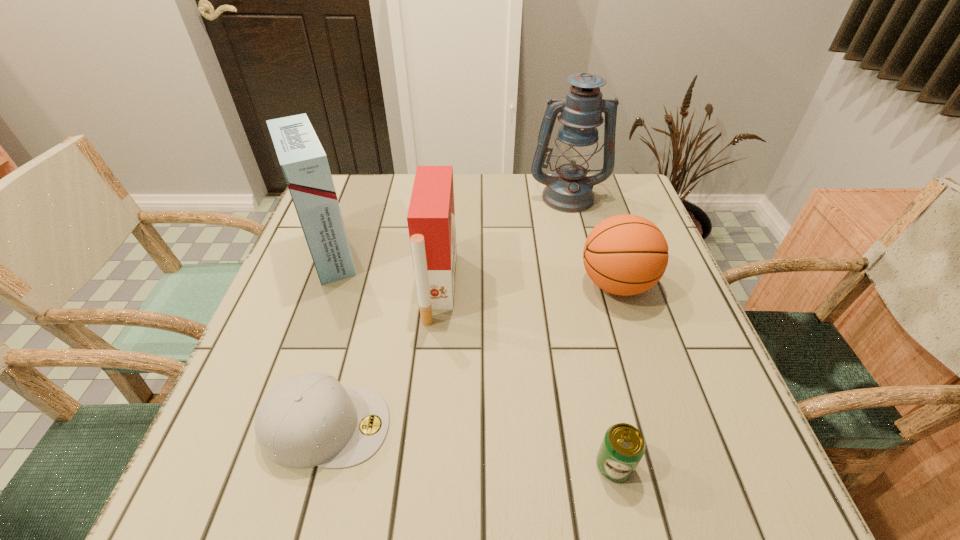
The image size is (960, 540). I want to click on vacant region located 0.100m on the front of the fourth tallest object, so click(x=637, y=350).

At what (x,y) coordinates should I click in order to perform the action: click on vacant space located on the front-facing side of the cap. Please return your answer as a coordinate pair (x, y). This screenshot has height=540, width=960. Looking at the image, I should click on (452, 426).

This screenshot has height=540, width=960. In order to click on free space located on the back of the beer can in this screenshot , I will do `click(594, 376)`.

The width and height of the screenshot is (960, 540). Find the location of `object that is at the far edge`. object that is at the far edge is located at coordinates (569, 190).

This screenshot has width=960, height=540. Find the location of `cap at the near edge`. cap at the near edge is located at coordinates (307, 420).

Locate an element on the screen. beer can at the near edge is located at coordinates (623, 446).

This screenshot has height=540, width=960. I want to click on cigarette case located in the left edge section of the desktop, so pos(304,163).

Identify the location of cap at the left edge. The width and height of the screenshot is (960, 540). click(x=307, y=420).

Locate an element on the screen. The height and width of the screenshot is (540, 960). lantern positioned at the right edge is located at coordinates (569, 190).

Where is `basketball located in the right edge section of the desktop`? basketball located in the right edge section of the desktop is located at coordinates (626, 254).